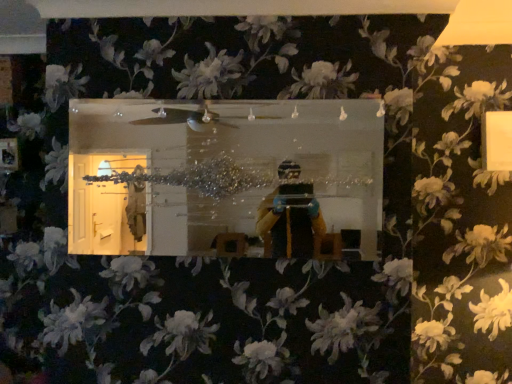
This screenshot has width=512, height=384. What are the coordinates of `clear glass mirror at center` in the screenshot? It's located at (222, 174).

Measure the distance between point (225, 128) and camera.

Point (225, 128) is 5.29 feet from camera.

This screenshot has height=384, width=512. Describe the element at coordinates (222, 174) in the screenshot. I see `clear glass mirror at center` at that location.

Where is `clear glass mirror at center`? Image resolution: width=512 pixels, height=384 pixels. clear glass mirror at center is located at coordinates (222, 174).